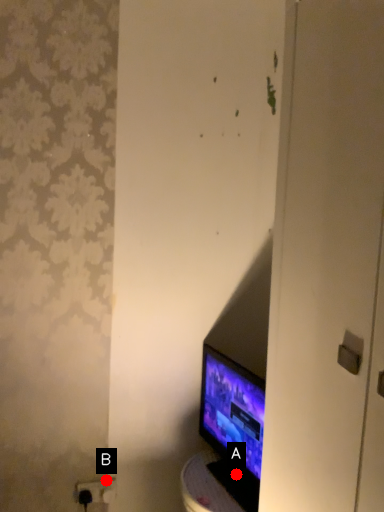
Question: Two points are circled on the image, labeled by A and B beside each circle. Which of the following is the closest to the observer?

Choices:
 (A) A is closer
 (B) B is closer

Answer: (A)